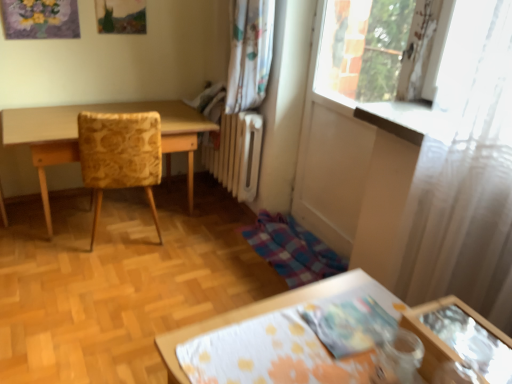
I want to click on free point in front of yellow floral fabric chair at left, so click(98, 275).